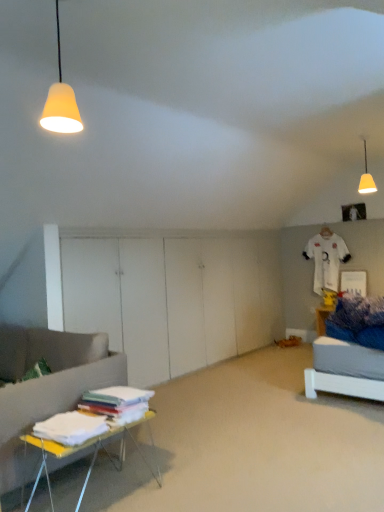
I want to click on free area below white cotton sheets at lower left (from a real-world perspective), so click(x=80, y=424).